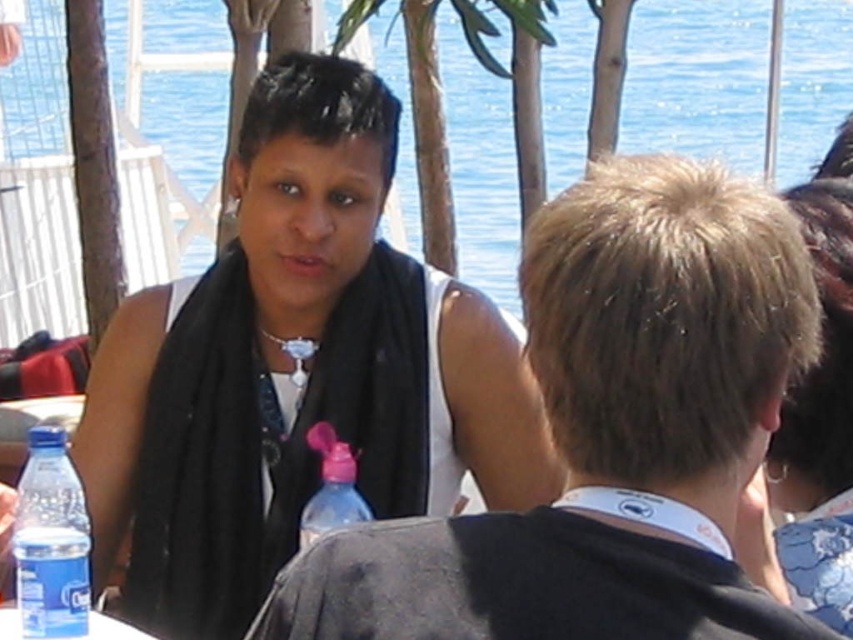
You are standing at the edge of the lake and want to walk towards the two points marked in the image. Which point, point (341, 445) or point (97, 616), will you reach first?

Point (341, 445) is further to the viewer than point (97, 616), so you will reach point (341, 445) first.

You are at a picnic by the lake and notice two bottles on the table. The blue plastic bottle at lower left and the pink plastic bottle at center. Which bottle is directly beneath the other?

The blue plastic bottle at lower left is positioned under the pink plastic bottle at center, so the blue one is directly beneath the pink one.

You are organizing a picnic and need to choose a water bottle that can hold more liquid. Based on the image, which bottle should you pick between the blue plastic bottle at lower left and the pink plastic bottle at center?

The blue plastic bottle at lower left has a greater height compared to the pink plastic bottle at center, so it can hold more liquid.